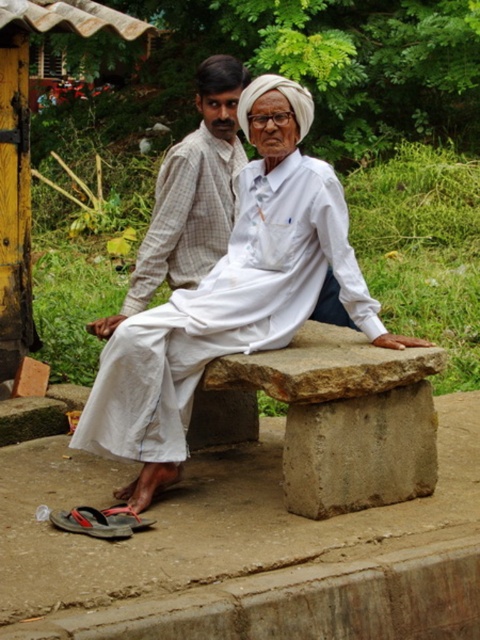
Question: From the image, what is the correct spatial relationship of white cotton cloth at center in relation to light brown checkered shirt at center?

Choices:
 (A) left
 (B) right

Answer: (B)

Question: Which point appears closest to the camera in this image?

Choices:
 (A) (288, 115)
 (B) (232, 116)

Answer: (A)

Question: Which object appears closest to the camera in this image?

Choices:
 (A) light brown checkered shirt at center
 (B) white cotton cloth at center

Answer: (B)

Question: Does white cotton cloth at center appear on the left side of light brown checkered shirt at center?

Choices:
 (A) no
 (B) yes

Answer: (A)

Question: Is white cotton cloth at center bigger than light brown checkered shirt at center?

Choices:
 (A) yes
 (B) no

Answer: (A)